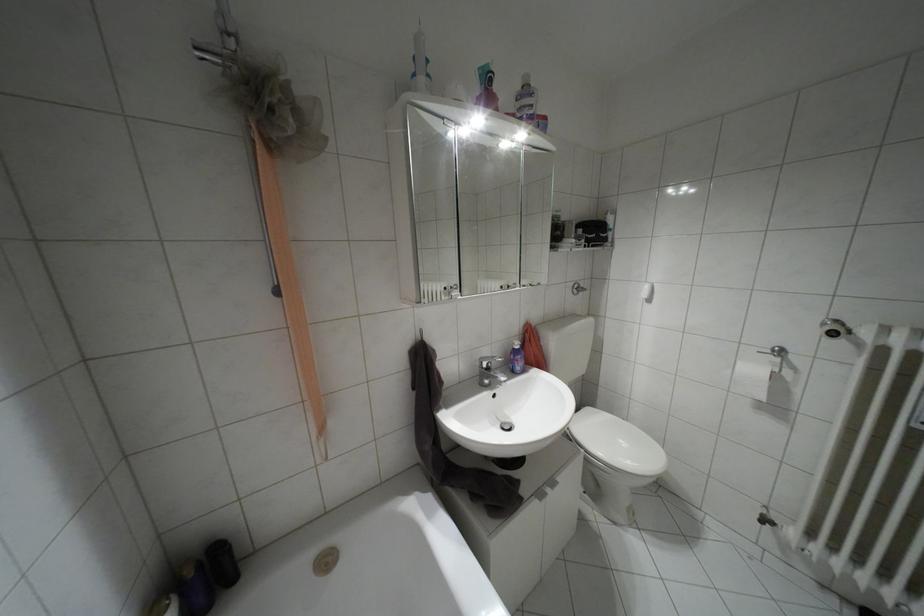
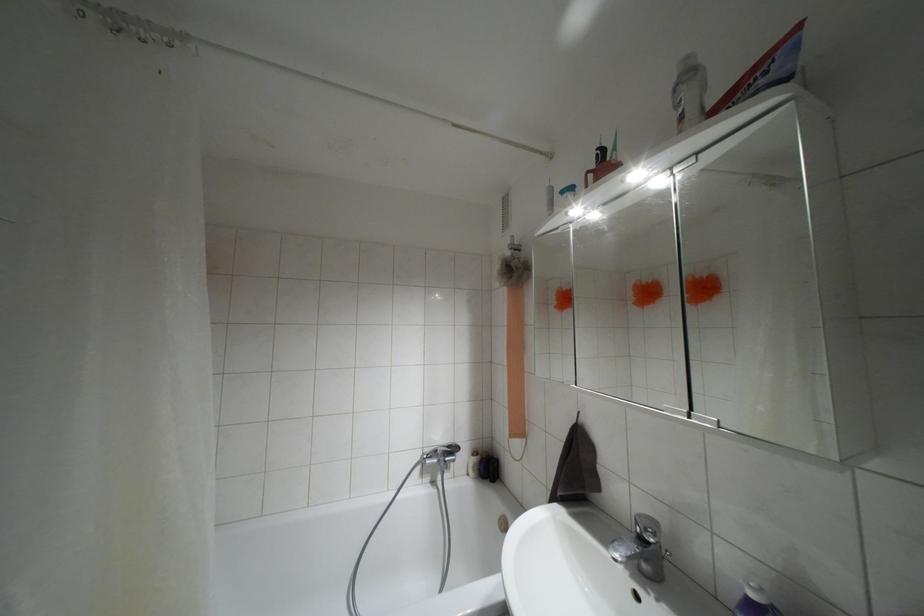
In the second image, find the point that corresponds to point (517, 346) in the first image.

(751, 594)